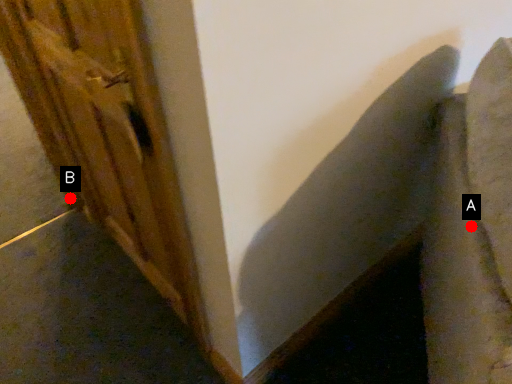
Question: Two points are circled on the image, labeled by A and B beside each circle. Among these points, which one is nearest to the camera?

Choices:
 (A) A is closer
 (B) B is closer

Answer: (A)